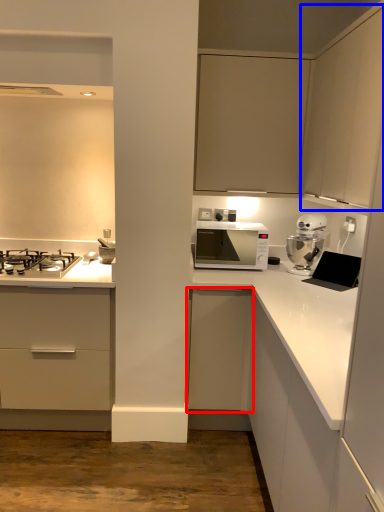
Question: Which object appears closest to the camera in this image, cabinetry (highlighted by a red box) or cabinetry (highlighted by a blue box)?

Choices:
 (A) cabinetry
 (B) cabinetry

Answer: (B)